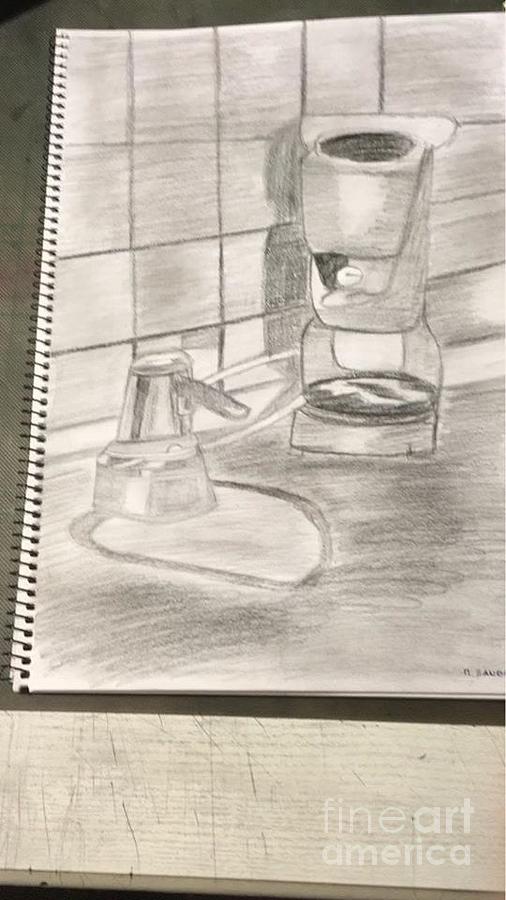
The image size is (506, 900). I want to click on handle, so click(x=218, y=399).